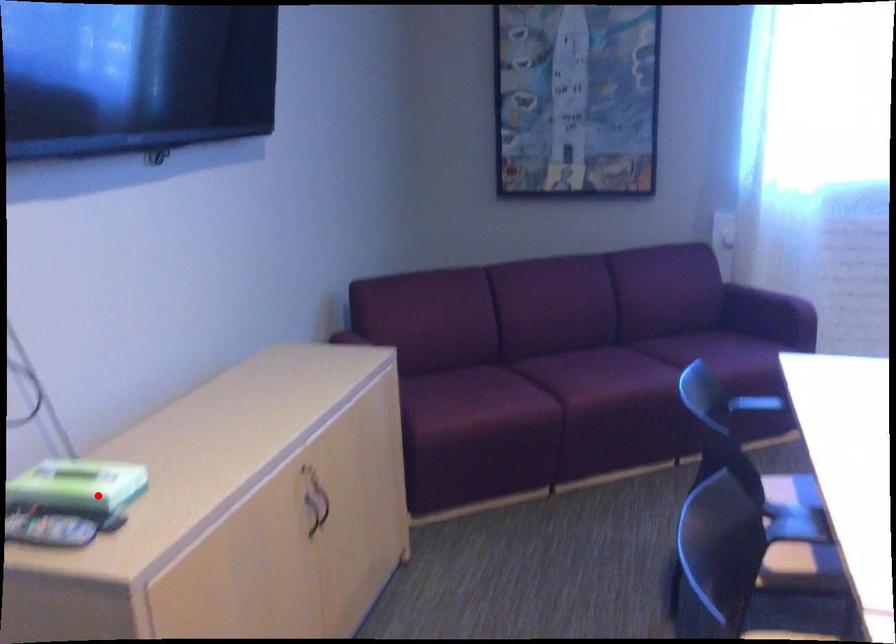
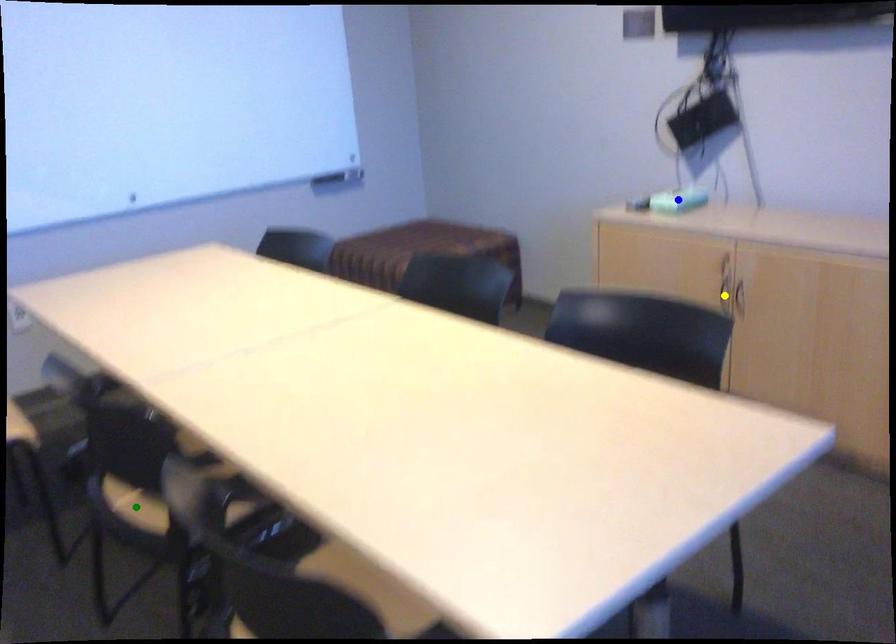
Question: I am providing you with two images of the same scene from different viewpoints. A red point is marked on the first image. You are given multiple points on the second image. Which point in image 2 represents the same 3d spot as the red point in image 1?

Choices:
 (A) yellow point
 (B) blue point
 (C) green point

Answer: (B)